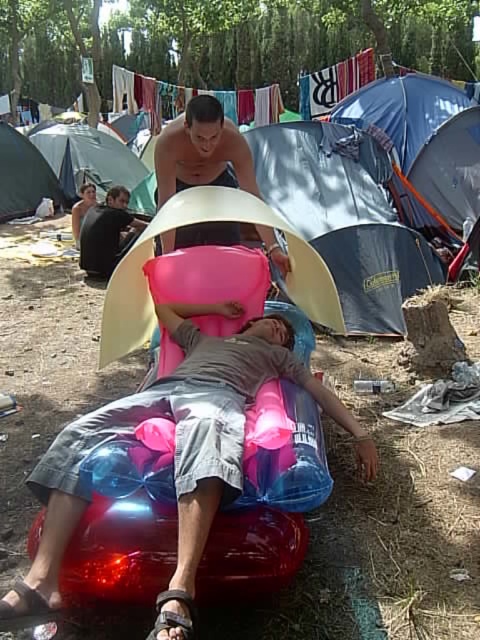
Can you confirm if pink inflatable at center is bigger than smooth tan skin at center?

Indeed, pink inflatable at center has a larger size compared to smooth tan skin at center.

Is pink inflatable at center to the right of smooth tan skin at center from the viewer's perspective?

Yes, pink inflatable at center is to the right of smooth tan skin at center.

Is point (203, 442) behind point (219, 144)?

That is False.

Locate an element on the screen. The image size is (480, 640). pink inflatable at center is located at coordinates (182, 433).

From the picture: Is green fabric tent at left in front of black leather sandal at lower left?

No, it is not.

Is point (59, 205) farther from viewer compared to point (179, 630)?

That is True.

At what (x,y) coordinates should I click in order to perform the action: click on green fabric tent at left. Please return your answer as a coordinate pair (x, y). The width and height of the screenshot is (480, 640). Looking at the image, I should click on (24, 177).

Does green fabric tent at upper left have a larger size compared to black leather sandal at lower left?

Yes, green fabric tent at upper left is bigger than black leather sandal at lower left.

Who is taller, green fabric tent at upper left or black leather sandal at lower left?

Standing taller between the two is green fabric tent at upper left.

Who is more forward, (43, 150) or (179, 616)?

Point (179, 616) is more forward.

Identify the location of green fabric tent at upper left. The height and width of the screenshot is (640, 480). (94, 161).